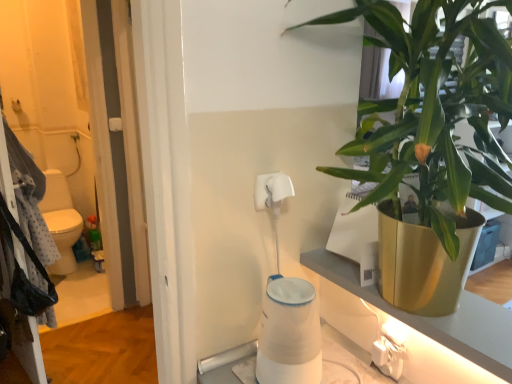
Where is `vacant point to the right of white matte toilet paper at center, arranged as the 1th toilet paper when ordered from the bottom`? Image resolution: width=512 pixels, height=384 pixels. vacant point to the right of white matte toilet paper at center, arranged as the 1th toilet paper when ordered from the bottom is located at coordinates (345, 366).